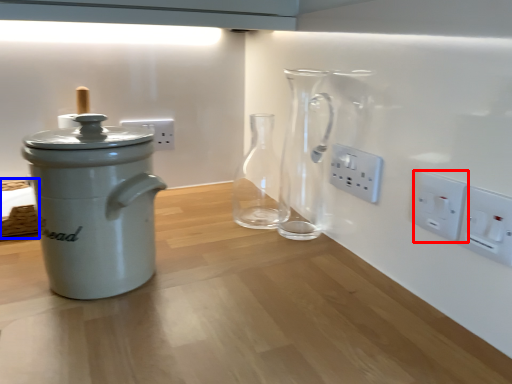
Question: Which of the following is the farthest to the observer, electric outlet (highlighted by a red box) or basket (highlighted by a blue box)?

Choices:
 (A) electric outlet
 (B) basket

Answer: (B)